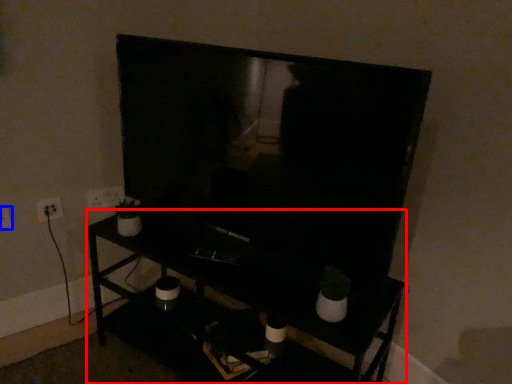
Question: Which point is further to the camera, furniture (highlighted by a red box) or electric outlet (highlighted by a blue box)?

Choices:
 (A) furniture
 (B) electric outlet

Answer: (B)